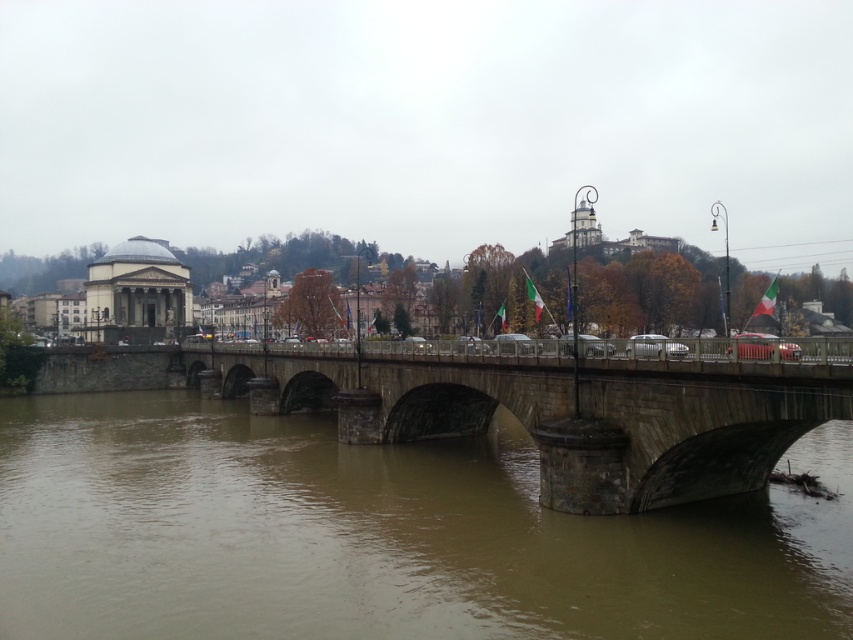
Question: Is brown stone river at center below stone bridge at center?

Choices:
 (A) no
 (B) yes

Answer: (B)

Question: Which object is closer to the camera taking this photo?

Choices:
 (A) stone bridge at center
 (B) brown stone river at center

Answer: (B)

Question: Is brown stone river at center above stone bridge at center?

Choices:
 (A) yes
 (B) no

Answer: (B)

Question: Is brown stone river at center behind stone bridge at center?

Choices:
 (A) yes
 (B) no

Answer: (B)